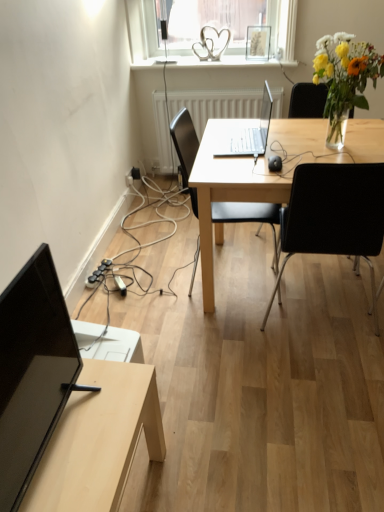
Question: Is black leather chair at center, the first chair in the left-to-right sequence, wider or thinner than black plastic chair at center, placed as the second chair when sorted from left to right?

Choices:
 (A) wide
 (B) thin

Answer: (B)

Question: From a real-world perspective, is black leather chair at center, the first chair in the left-to-right sequence, physically located above or below black plastic chair at center, placed as the second chair when sorted from left to right?

Choices:
 (A) below
 (B) above

Answer: (A)

Question: Which object is positioned farthest from the light wood table at lower left?

Choices:
 (A) black glossy monitor at lower left
 (B) black plastic chair at center, the first chair in the right-to-left sequence
 (C) translucent glass vase at upper right
 (D) silver metallic laptop at center
 (E) white textured radiator at center

Answer: (E)

Question: Estimate the real-world distances between objects in this image. Which object is farther from the black rubber extension cord at lower left?

Choices:
 (A) light wood desk at center
 (B) black plastic chair at center, the first chair in the right-to-left sequence
 (C) black leather chair at center, the first chair in the left-to-right sequence
 (D) light wood table at lower left
 (E) white textured radiator at center

Answer: (E)